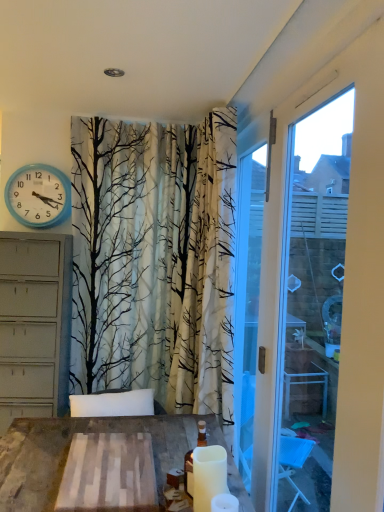
Question: Considering the positions of white matte candle at lower right, which ranks as the 2th candle in back-to-front order, and white matte candle at lower center, the 1th candle when ordered from back to front, in the image, is white matte candle at lower right, which ranks as the 2th candle in back-to-front order, bigger or smaller than white matte candle at lower center, the 1th candle when ordered from back to front,?

Choices:
 (A) small
 (B) big

Answer: (A)

Question: Considering the relative positions of white matte candle at lower right, which ranks as the 2th candle in back-to-front order, and white matte candle at lower center, the 1th candle when ordered from back to front, in the image provided, is white matte candle at lower right, which ranks as the 2th candle in back-to-front order, to the left or to the right of white matte candle at lower center, the 1th candle when ordered from back to front,?

Choices:
 (A) right
 (B) left

Answer: (A)

Question: Considering the real-world distances, which object is farthest from the blue plastic wall clock at upper left?

Choices:
 (A) white plastic window frame at right
 (B) white matte candle at lower center, the 1th candle when ordered from back to front
 (C) white matte candle at lower right, which ranks as the 2th candle in back-to-front order

Answer: (C)

Question: Estimate the real-world distances between objects in this image. Which object is farther from the blue plastic wall clock at upper left?

Choices:
 (A) white matte candle at lower right, which ranks as the 2th candle in back-to-front order
 (B) white plastic window frame at right
 (C) white matte candle at lower center, the 1th candle when ordered from back to front

Answer: (A)